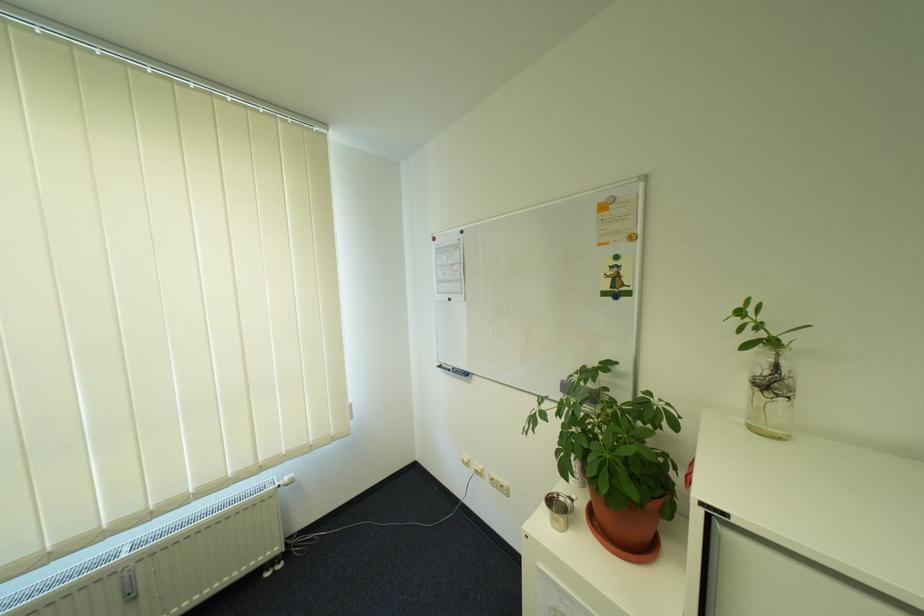
This screenshot has height=616, width=924. I want to click on white thermostat knob, so click(286, 480).